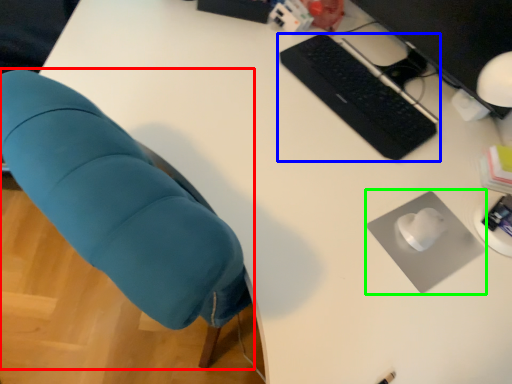
Question: Which object is positioned farthest from chair (highlighted by a red box)? Select from computer keyboard (highlighted by a blue box) and mousepad (highlighted by a green box).

Choices:
 (A) computer keyboard
 (B) mousepad

Answer: (A)